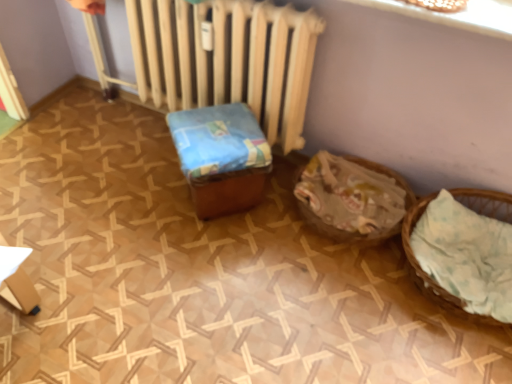
The height and width of the screenshot is (384, 512). Find the location of `free space in front of white matte radiator at center`. free space in front of white matte radiator at center is located at coordinates (155, 271).